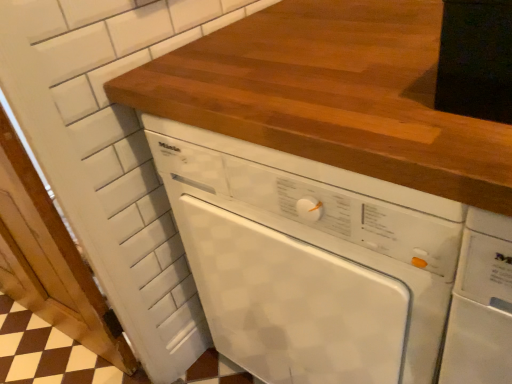
Question: Is white painted wood door at left bigger than wooden countertop at center?

Choices:
 (A) no
 (B) yes

Answer: (B)

Question: From a real-world perspective, is white painted wood door at left below wooden countertop at center?

Choices:
 (A) yes
 (B) no

Answer: (A)

Question: Is the depth of white painted wood door at left greater than that of wooden countertop at center?

Choices:
 (A) yes
 (B) no

Answer: (A)

Question: Is white painted wood door at left outside of wooden countertop at center?

Choices:
 (A) yes
 (B) no

Answer: (A)

Question: Can you confirm if white painted wood door at left is thinner than wooden countertop at center?

Choices:
 (A) no
 (B) yes

Answer: (B)

Question: From a real-world perspective, is white glossy dishwasher at center positioned above or below wooden countertop at center?

Choices:
 (A) above
 (B) below

Answer: (B)

Question: Considering the positions of white glossy dishwasher at center and wooden countertop at center in the image, is white glossy dishwasher at center wider or thinner than wooden countertop at center?

Choices:
 (A) thin
 (B) wide

Answer: (B)

Question: Considering their positions, is white glossy dishwasher at center located in front of or behind wooden countertop at center?

Choices:
 (A) front
 (B) behind

Answer: (B)

Question: Based on their sizes in the image, would you say white glossy dishwasher at center is bigger or smaller than wooden countertop at center?

Choices:
 (A) big
 (B) small

Answer: (A)

Question: Considering the positions of wooden countertop at center and white painted wood door at left in the image, is wooden countertop at center bigger or smaller than white painted wood door at left?

Choices:
 (A) small
 (B) big

Answer: (A)

Question: Which is correct: wooden countertop at center is inside white painted wood door at left, or outside of it?

Choices:
 (A) inside
 (B) outside

Answer: (B)

Question: In the image, is wooden countertop at center on the left side or the right side of white painted wood door at left?

Choices:
 (A) left
 (B) right

Answer: (B)

Question: Is point (424, 119) closer or farther from the camera than point (1, 223)?

Choices:
 (A) closer
 (B) farther

Answer: (A)

Question: Do you think white glossy dishwasher at center is within white painted wood door at left, or outside of it?

Choices:
 (A) inside
 (B) outside

Answer: (B)

Question: Looking at their shapes, would you say white glossy dishwasher at center is wider or thinner than white painted wood door at left?

Choices:
 (A) thin
 (B) wide

Answer: (B)